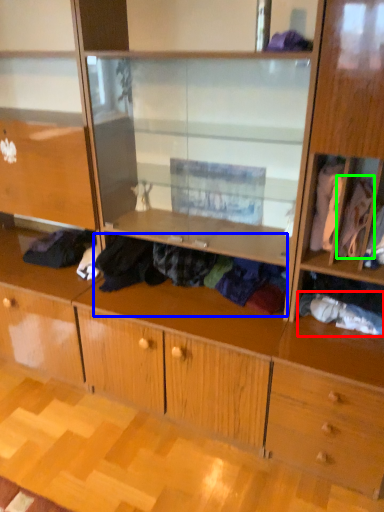
Question: Based on their relative distances, which object is farther from clothing (highlighted by a red box)? Choose from clothing (highlighted by a blue box) and clothing (highlighted by a green box).

Choices:
 (A) clothing
 (B) clothing

Answer: (A)